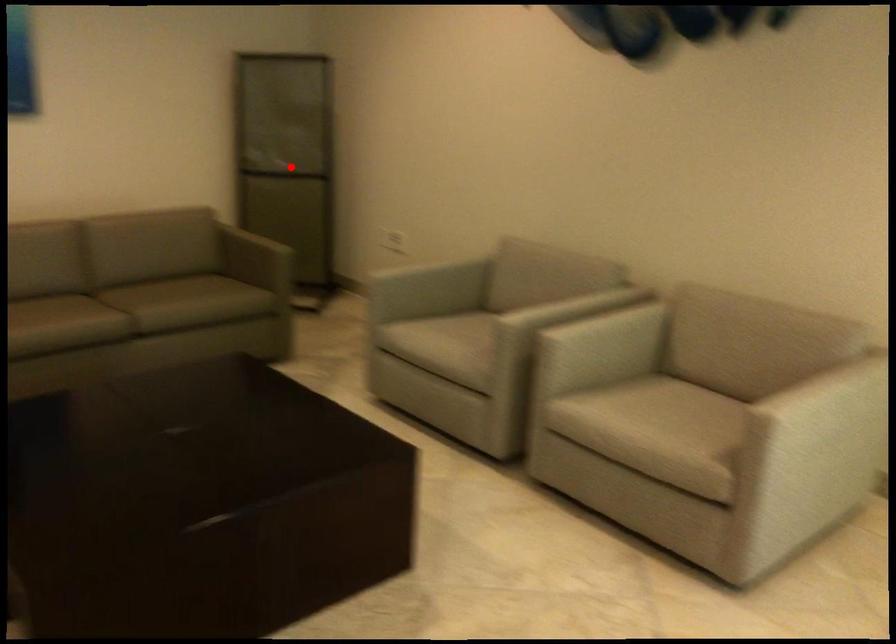
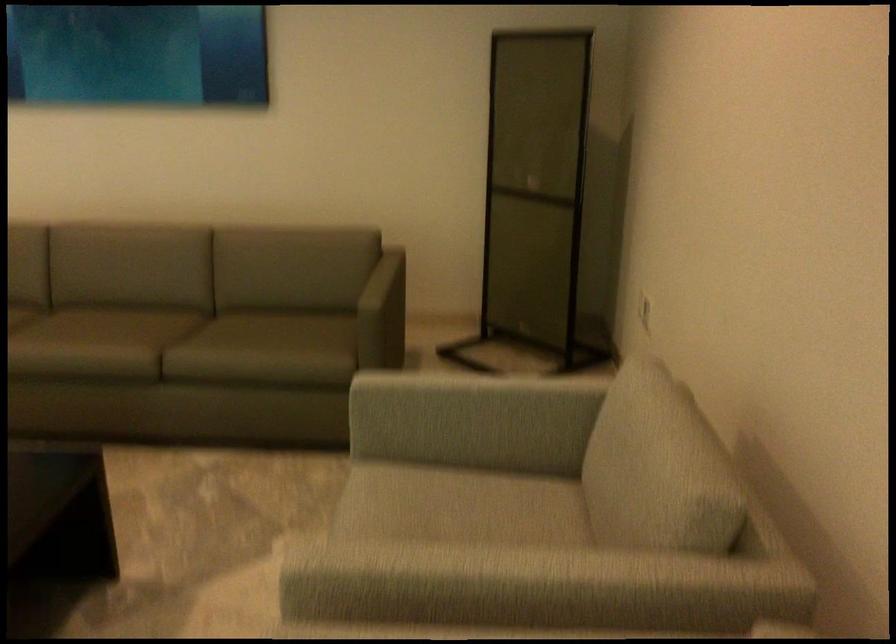
Question: I am providing you with two images of the same scene from different viewpoints. A red point is marked on the first image. At the location where the point appears in image 1, is it still visible in image 2?

Choices:
 (A) Yes
 (B) No

Answer: (A)